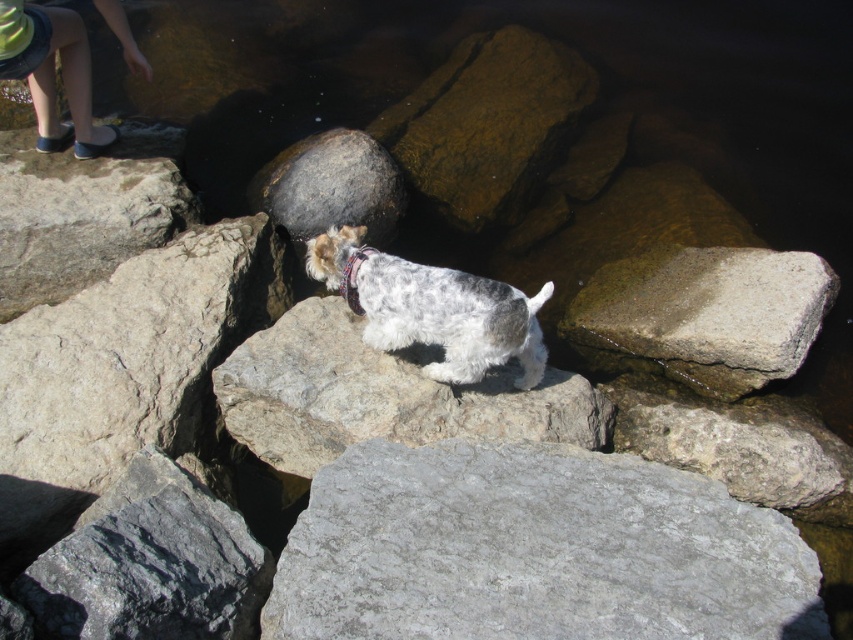
Can you confirm if gray rough rock at lower left is bigger than brown rough rock at center?

No.

Who is positioned more to the left, gray rough rock at lower left or brown rough rock at center?

gray rough rock at lower left is more to the left.

Does point (173, 595) come in front of point (467, 212)?

Yes.

This screenshot has width=853, height=640. Find the location of `gray rough rock at lower left`. gray rough rock at lower left is located at coordinates (149, 564).

Does point (65, 276) come closer to viewer compared to point (375, 164)?

That is True.

Does gray rough rock at upper left appear on the left side of dark gray stone boulder at center?

Indeed, gray rough rock at upper left is positioned on the left side of dark gray stone boulder at center.

What are the coordinates of `gray rough rock at upper left` in the screenshot? It's located at (84, 212).

Is gray rough rock at lower right further to the viewer compared to dark gray stone boulder at center?

No.

Does gray rough rock at lower right have a greater height compared to dark gray stone boulder at center?

No.

The height and width of the screenshot is (640, 853). Identify the location of gray rough rock at lower right. (740, 449).

What are the coordinates of `gray rough rock at lower right` in the screenshot? It's located at (740, 449).